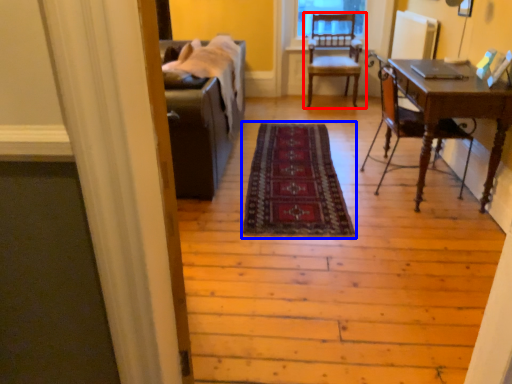
Question: Which object is further to the camera taking this photo, chair (highlighted by a red box) or mat (highlighted by a blue box)?

Choices:
 (A) chair
 (B) mat

Answer: (A)